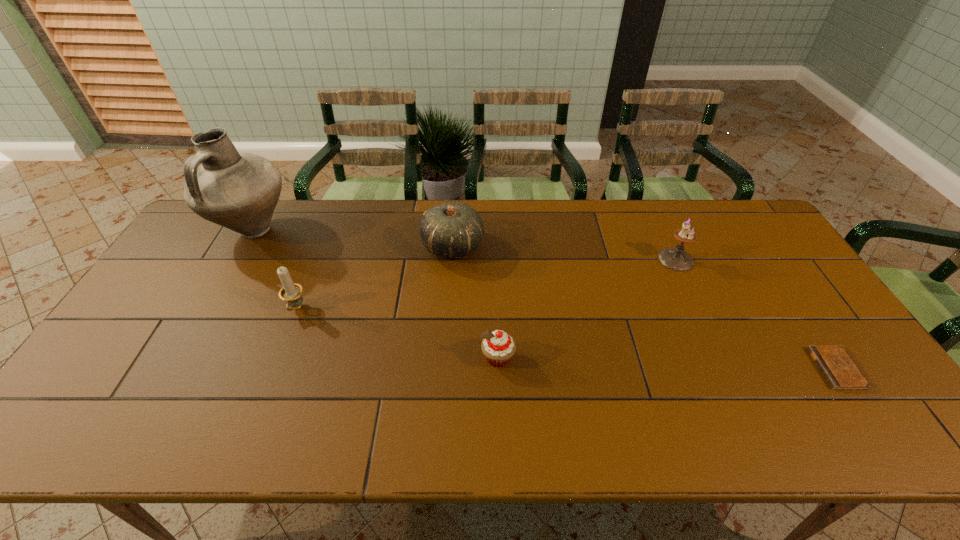
Locate an element on the screen. The image size is (960, 540). object at the left edge is located at coordinates (237, 190).

Identify the location of object at the right edge. (839, 370).

Image resolution: width=960 pixels, height=540 pixels. Find the location of `object at the far left corner`. object at the far left corner is located at coordinates (237, 190).

The height and width of the screenshot is (540, 960). I want to click on free space at the far edge of the desktop, so click(358, 210).

Find the location of a particular element. The width and height of the screenshot is (960, 540). blank area at the near edge is located at coordinates (540, 444).

At what (x,y) coordinates should I click in order to perform the action: click on blank space at the left edge of the desktop. Please return your answer as a coordinate pair (x, y). The image size is (960, 540). Looking at the image, I should click on (134, 385).

In the image, there is a desktop. Find the location of `vacant space at the right edge`. vacant space at the right edge is located at coordinates 797,300.

Locate an element on the screen. This screenshot has height=540, width=960. vacant space at the far right corner of the desktop is located at coordinates (719, 209).

I want to click on free point between the shortest object and the fourth farthest object, so click(566, 339).

Where is `unoccupied position between the third nearest object and the pitcher`? The image size is (960, 540). unoccupied position between the third nearest object and the pitcher is located at coordinates (276, 269).